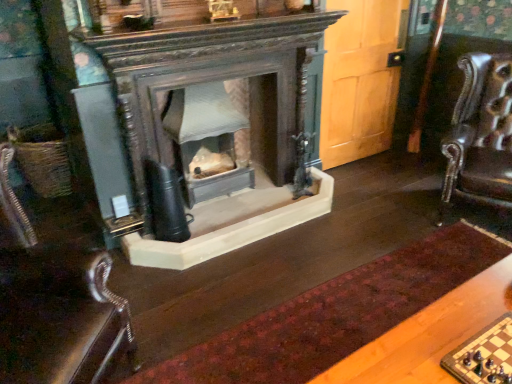
Locate an element on the screen. The width and height of the screenshot is (512, 384). free space behind leather swivel chair at right is located at coordinates pyautogui.click(x=409, y=179).